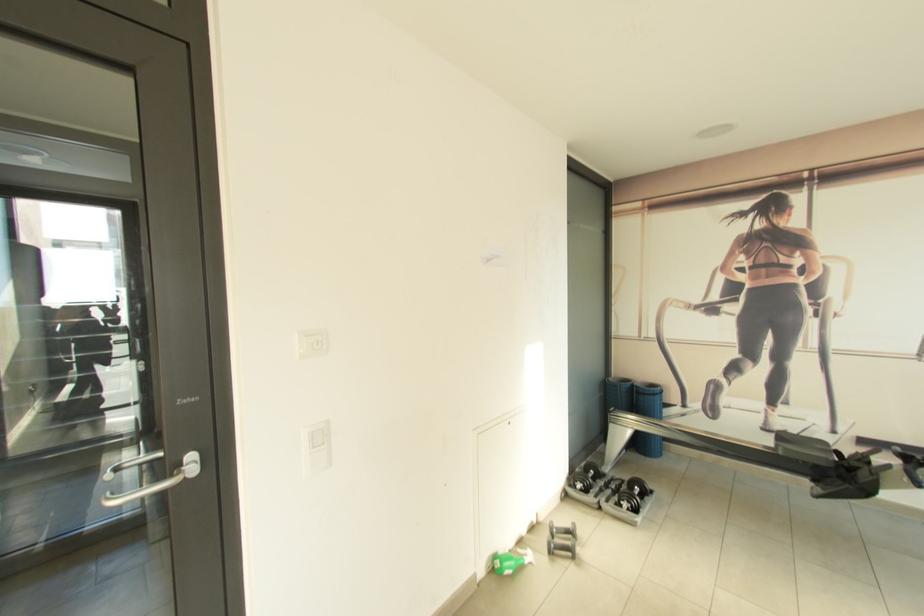
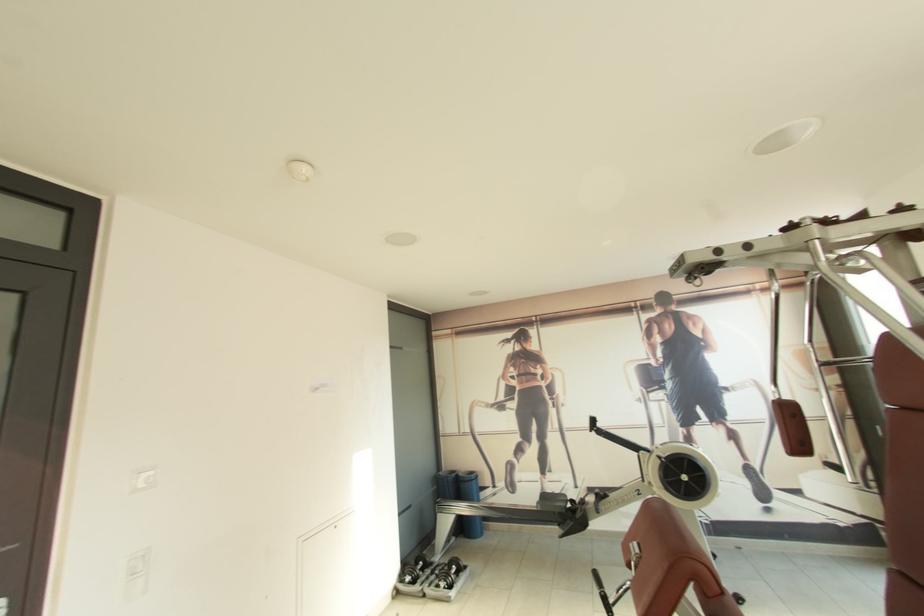
Where in the second image is the point corresponding to pixel 615 381 from the first image?

(445, 475)